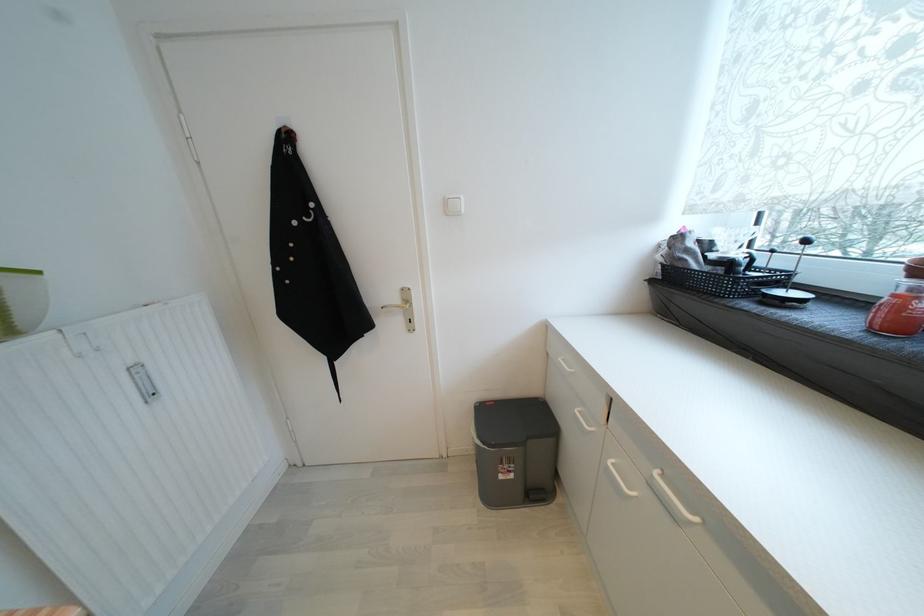
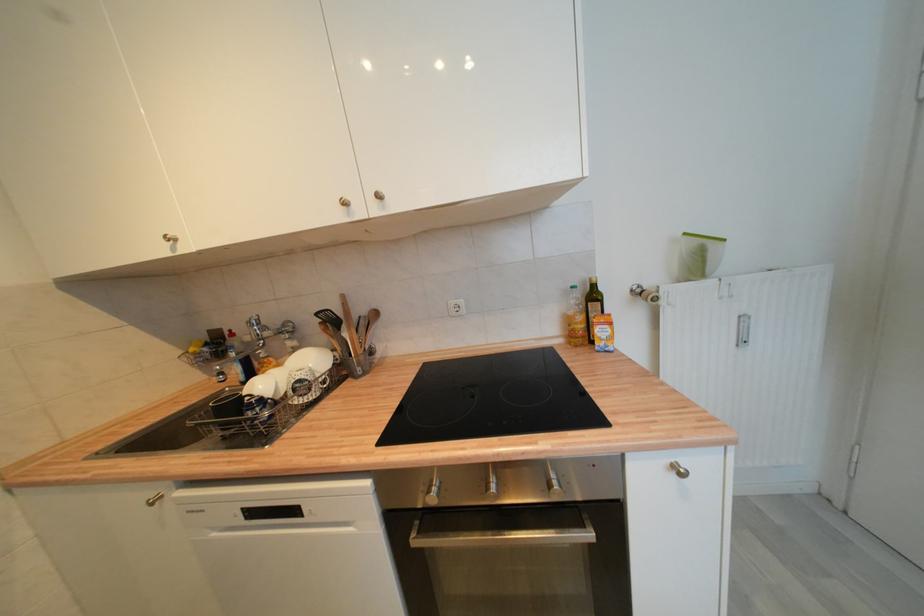
How did the camera likely rotate?

The camera rotated toward left-down.